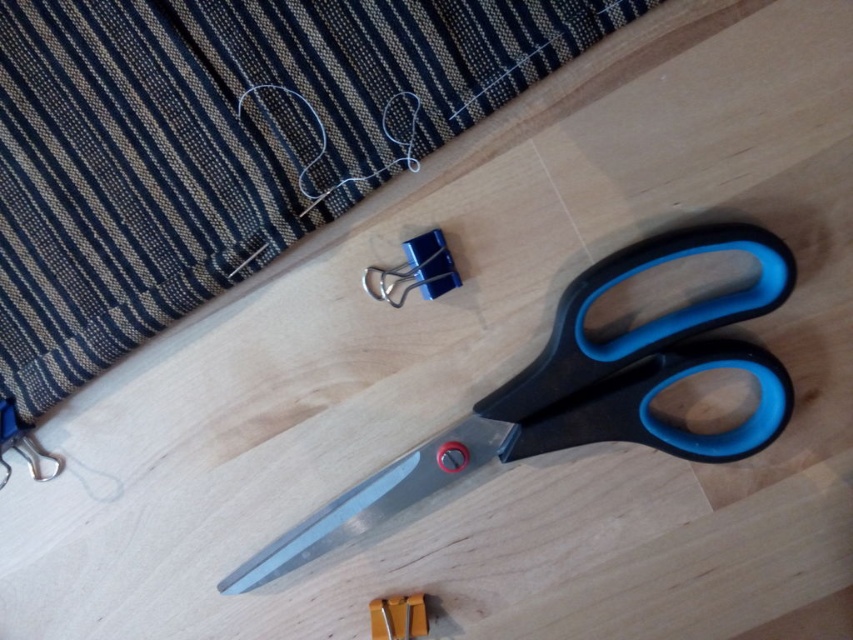
You are organizing a sewing kit and need to place the yellow plastic ruler at lower center and the metallic silver scissors at lower left into a small drawer. Based on their sizes, which item will require more space in the drawer?

The metallic silver scissors at lower left require more space in the drawer because the yellow plastic ruler at lower center occupies less space than them according to the description.

You are a tailor working on a project and need to place a 18 inch long ruler between the metallic blue binder clip at center and the metallic silver scissors at lower left. Will there be enough space for the ruler without overlapping either object?

The distance between the metallic blue binder clip at center and the metallic silver scissors at lower left is 20.11 inches. Since the ruler is 18 inches long, there is enough space to place it between them without overlapping either object.